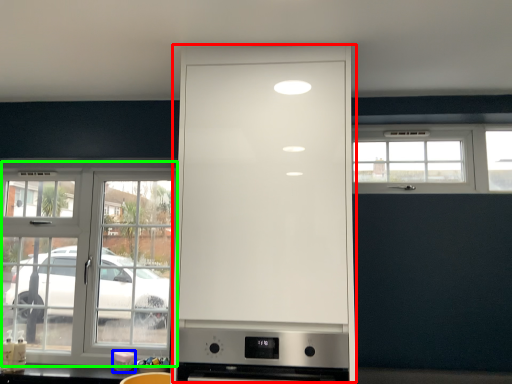
Question: Considering the real-world distances, which object is closest to cabinetry (highlighted by a red box)? appliance (highlighted by a blue box) or window (highlighted by a green box).

Choices:
 (A) appliance
 (B) window

Answer: (B)